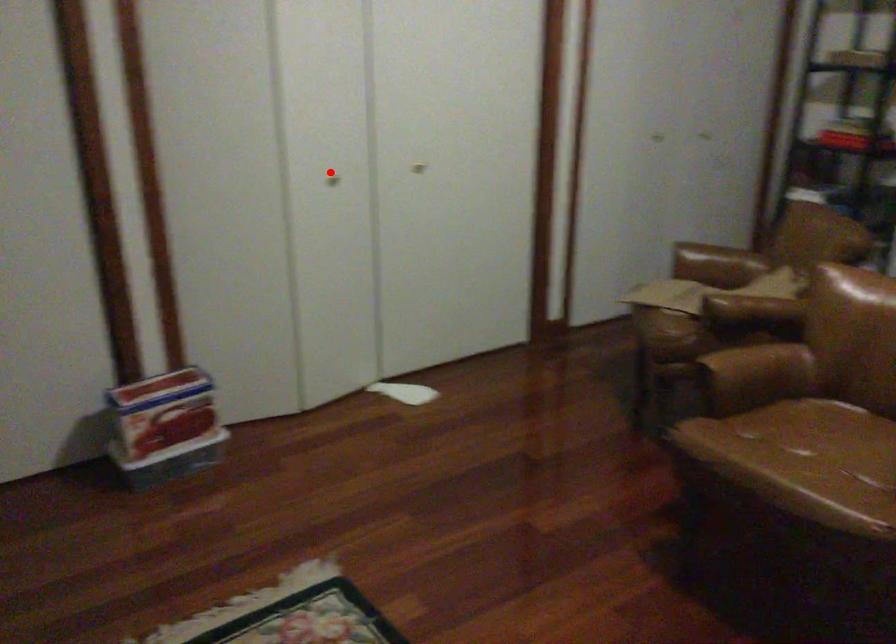
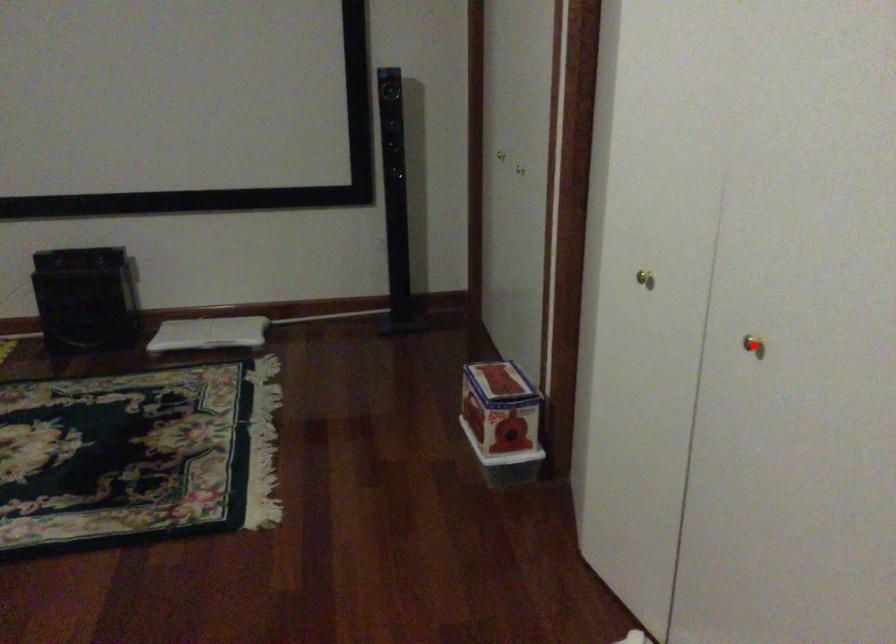
I am providing you with two images of the same scene from different viewpoints. A red point is marked on the first image and another point is marked on the second image. Do the highlighted points in image1 and image2 indicate the same real-world spot?

No